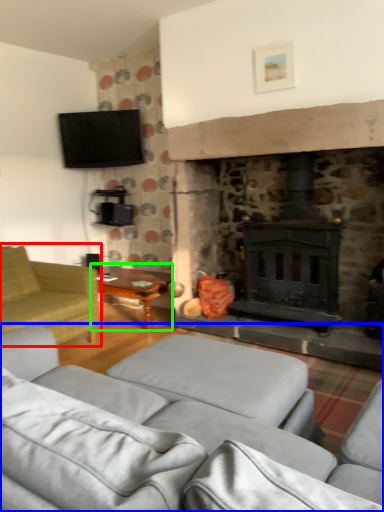
Question: Estimate the real-world distances between objects in this image. Which object is farther from studio couch (highlighted by a red box), studio couch (highlighted by a blue box) or table (highlighted by a green box)?

Choices:
 (A) studio couch
 (B) table

Answer: (A)